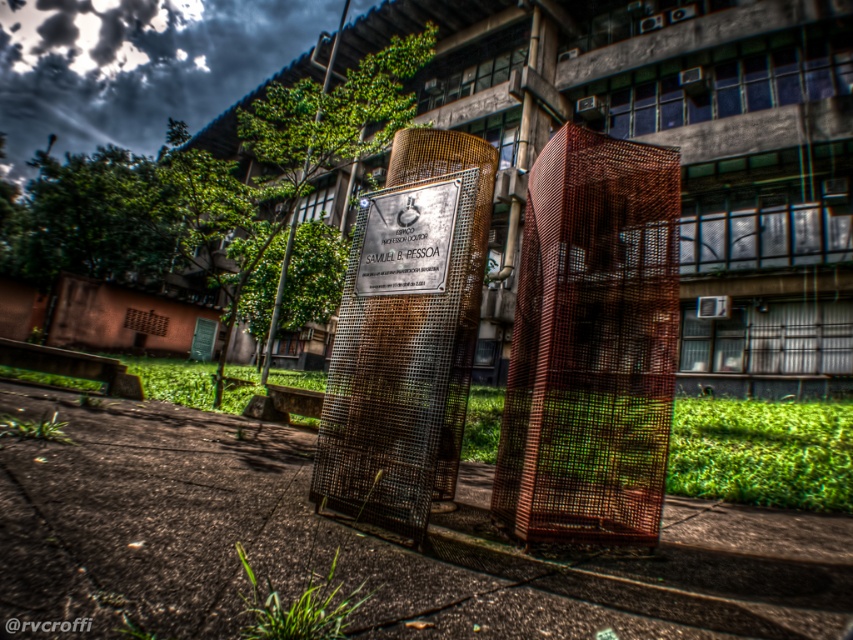
Question: Considering the relative positions of rusty wire mesh at center and polished brass plaque at center in the image provided, where is rusty wire mesh at center located with respect to polished brass plaque at center?

Choices:
 (A) below
 (B) above

Answer: (A)

Question: Which is nearer to the rusty wire mesh at center?

Choices:
 (A) polished brass plaque at center
 (B) rusty mesh cage at center

Answer: (B)

Question: In this image, where is rusty wire mesh at center located relative to polished brass plaque at center?

Choices:
 (A) below
 (B) above

Answer: (A)

Question: Among these objects, which one is farthest from the camera?

Choices:
 (A) polished brass plaque at center
 (B) rusty mesh cage at center

Answer: (A)

Question: Considering the relative positions of rusty mesh cage at center and polished brass plaque at center in the image provided, where is rusty mesh cage at center located with respect to polished brass plaque at center?

Choices:
 (A) right
 (B) left

Answer: (A)

Question: Which of the following is the farthest from the observer?

Choices:
 (A) rusty mesh cage at center
 (B) polished brass plaque at center
 (C) rusty wire mesh at center

Answer: (B)